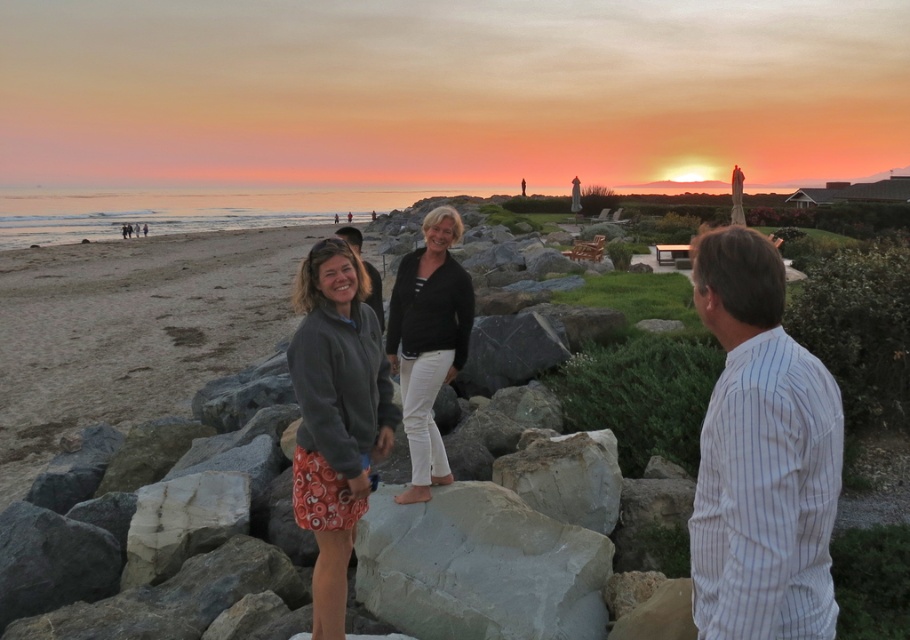
Question: Which is nearer to the gray smooth rock at center?

Choices:
 (A) orange printed skirt at center
 (B) white cotton pants at center
 (C) white shirt at center
 (D) white striped shirt at right

Answer: (A)

Question: Estimate the real-world distances between objects in this image. Which object is closer to the white shirt at center?

Choices:
 (A) white marble rock at center
 (B) orange printed skirt at center
 (C) white cotton pants at center

Answer: (B)

Question: Which is farther from the white marble rock at center?

Choices:
 (A) white cotton pants at center
 (B) gray smooth rock at center
 (C) white striped shirt at right

Answer: (C)

Question: In this image, where is gray smooth rock at center located relative to white cotton pants at center?

Choices:
 (A) below
 (B) above

Answer: (A)

Question: Can you confirm if orange printed skirt at center is bigger than white shirt at center?

Choices:
 (A) no
 (B) yes

Answer: (A)

Question: Can you confirm if orange printed skirt at center is positioned below white cotton pants at center?

Choices:
 (A) no
 (B) yes

Answer: (B)